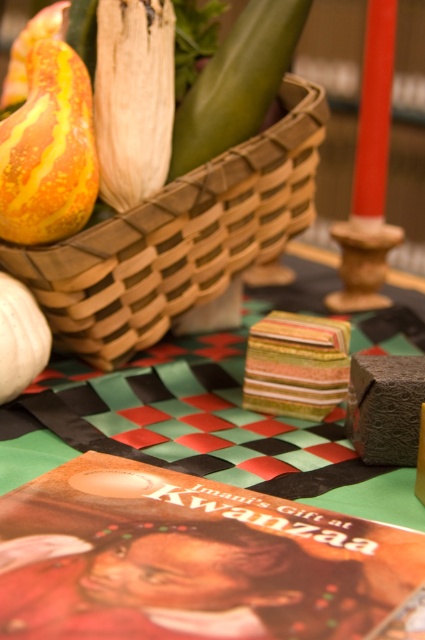
Where is `yellow-orange striped gourd at upper left`? This screenshot has width=425, height=640. yellow-orange striped gourd at upper left is located at coordinates (48, 150).

Between point (36, 237) and point (175, 163), which one is positioned behind?

The point (175, 163) is more distant.

Does point (2, 125) come closer to viewer compared to point (235, 134)?

Yes, it is in front of point (235, 134).

Identify the location of yellow-orange striped gourd at upper left. The height and width of the screenshot is (640, 425). tap(48, 150).

Does woven wood basket at upper left have a greater width compared to green smooth vegetable at upper center?

Yes, woven wood basket at upper left is wider than green smooth vegetable at upper center.

Is point (116, 365) closer to camera compared to point (294, 4)?

No, it is behind (294, 4).

Where is `woven wood basket at upper left`? woven wood basket at upper left is located at coordinates (178, 240).

The height and width of the screenshot is (640, 425). What do you see at coordinates (197, 512) in the screenshot?
I see `striped paper napkin at center` at bounding box center [197, 512].

Can you confirm if striped paper napkin at center is positioned to the left of green smooth vegetable at upper center?

In fact, striped paper napkin at center is to the right of green smooth vegetable at upper center.

Where is `striped paper napkin at center`? This screenshot has width=425, height=640. striped paper napkin at center is located at coordinates (197, 512).